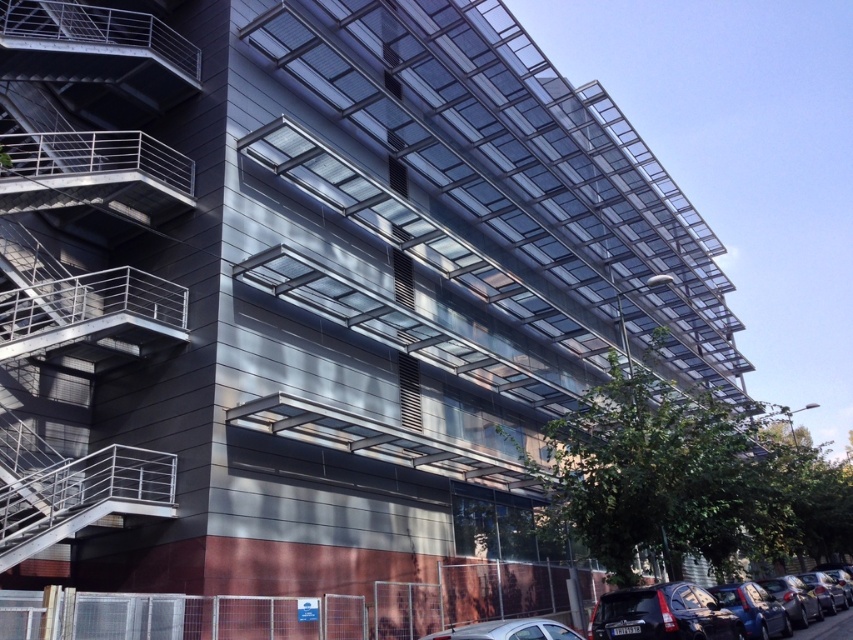
Question: Which point is farther from the camera taking this photo?

Choices:
 (A) (51, 540)
 (B) (778, 586)
 (C) (764, 632)
 (D) (467, 634)

Answer: (B)

Question: Does metallic blue car at lower right have a lesser width compared to metallic silver car at lower center?

Choices:
 (A) yes
 (B) no

Answer: (A)

Question: Does metallic silver fire escape at left appear under metallic silver car at lower center?

Choices:
 (A) yes
 (B) no

Answer: (B)

Question: Which object is farther from the camera taking this photo?

Choices:
 (A) metallic silver car at lower center
 (B) metallic silver fire escape at left
 (C) shiny black car at lower right
 (D) matte black car at lower right

Answer: (C)

Question: Does metallic silver car at lower center appear on the left side of matte black car at lower right?

Choices:
 (A) yes
 (B) no

Answer: (A)

Question: Which of the following is the closest to the observer?

Choices:
 (A) (28, 156)
 (B) (486, 628)

Answer: (B)